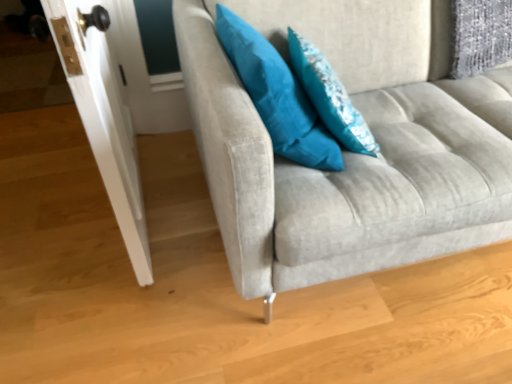
What is the approximate width of suede gray couch at center?

The width of suede gray couch at center is 35.99 inches.

Image resolution: width=512 pixels, height=384 pixels. I want to click on white glossy door at left, so click(x=103, y=120).

Based on the photo, considering the relative sizes of suede gray couch at center and white glossy door at left in the image provided, is suede gray couch at center bigger than white glossy door at left?

Yes.

Would you say suede gray couch at center is outside white glossy door at left?

suede gray couch at center lies outside white glossy door at left's area.

Which is behind, suede gray couch at center or white glossy door at left?

white glossy door at left is more distant.

From a real-world perspective, is suede gray couch at center over white glossy door at left?

No, from a real-world perspective, suede gray couch at center is not above white glossy door at left.

Is teal fabric pillow at upper center, the 2th pillow from the left, oriented towards white glossy door at left?

A: No, teal fabric pillow at upper center, the 2th pillow from the left, is not turned towards white glossy door at left.

Is teal fabric pillow at upper center, the 2th pillow from the left, smaller than white glossy door at left?

Indeed, teal fabric pillow at upper center, the 2th pillow from the left, has a smaller size compared to white glossy door at left.

From the picture: Can you tell me how much teal fabric pillow at upper center, the 2th pillow from the left, and white glossy door at left differ in facing direction?

teal fabric pillow at upper center, the 2th pillow from the left, and white glossy door at left are facing 171 degrees away from each other.

Are teal fabric pillow at upper center, positioned as the first pillow in right-to-left order, and white glossy door at left making contact?

No, teal fabric pillow at upper center, positioned as the first pillow in right-to-left order, is not with white glossy door at left.

Which object is closer to the camera taking this photo, teal fabric pillow at upper right, arranged as the second pillow when viewed from the right, or teal fabric pillow at upper center, the 2th pillow from the left?

teal fabric pillow at upper right, arranged as the second pillow when viewed from the right, is more forward.

Does teal fabric pillow at upper right, the 1th pillow positioned from the left, appear on the left side of teal fabric pillow at upper center, positioned as the first pillow in right-to-left order?

Yes, teal fabric pillow at upper right, the 1th pillow positioned from the left, is to the left of teal fabric pillow at upper center, positioned as the first pillow in right-to-left order.

Is teal fabric pillow at upper right, arranged as the second pillow when viewed from the right, not near teal fabric pillow at upper center, the 2th pillow from the left?

teal fabric pillow at upper right, arranged as the second pillow when viewed from the right, is actually quite close to teal fabric pillow at upper center, the 2th pillow from the left.

Does teal fabric pillow at upper right, arranged as the second pillow when viewed from the right, turn towards teal fabric pillow at upper center, the 2th pillow from the left?

Yes.

From the image's perspective, is suede gray couch at center located beneath teal fabric pillow at upper center, the 2th pillow from the left?

No.

In the scene shown: Considering the positions of objects suede gray couch at center and teal fabric pillow at upper center, the 2th pillow from the left, in the image provided, who is in front, suede gray couch at center or teal fabric pillow at upper center, the 2th pillow from the left,?

Positioned in front is suede gray couch at center.

Is suede gray couch at center wider or thinner than teal fabric pillow at upper center, the 2th pillow from the left?

suede gray couch at center is wider than teal fabric pillow at upper center, the 2th pillow from the left.

Who is taller, suede gray couch at center or teal fabric pillow at upper center, the 2th pillow from the left?

Standing taller between the two is suede gray couch at center.

Which of these two, white glossy door at left or teal fabric pillow at upper right, arranged as the second pillow when viewed from the right, stands taller?

white glossy door at left.

Considering the positions of objects white glossy door at left and teal fabric pillow at upper right, the 1th pillow positioned from the left, in the image provided, who is behind, white glossy door at left or teal fabric pillow at upper right, the 1th pillow positioned from the left,?

teal fabric pillow at upper right, the 1th pillow positioned from the left, is more distant.

Can you confirm if white glossy door at left is positioned to the right of teal fabric pillow at upper right, arranged as the second pillow when viewed from the right?

Incorrect, white glossy door at left is not on the right side of teal fabric pillow at upper right, arranged as the second pillow when viewed from the right.

From the image's perspective, is white glossy door at left below teal fabric pillow at upper right, the 1th pillow positioned from the left?

Yes.

How different are the orientations of teal fabric pillow at upper right, the 1th pillow positioned from the left, and white glossy door at left in degrees?

The facing directions of teal fabric pillow at upper right, the 1th pillow positioned from the left, and white glossy door at left are 171 degrees apart.

Between teal fabric pillow at upper right, arranged as the second pillow when viewed from the right, and white glossy door at left, which one appears on the left side from the viewer's perspective?

From the viewer's perspective, white glossy door at left appears more on the left side.

Is teal fabric pillow at upper right, the 1th pillow positioned from the left, oriented towards white glossy door at left?

No, teal fabric pillow at upper right, the 1th pillow positioned from the left, does not turn towards white glossy door at left.

From the image's perspective, is teal fabric pillow at upper right, the 1th pillow positioned from the left, below white glossy door at left?

No, from the image's perspective, teal fabric pillow at upper right, the 1th pillow positioned from the left, is not below white glossy door at left.

In the image, is white glossy door at left on the left side or the right side of suede gray couch at center?

In the image, white glossy door at left appears on the left side of suede gray couch at center.

Looking at this image, is white glossy door at left facing away from suede gray couch at center?

That's right, white glossy door at left is facing away from suede gray couch at center.

Who is bigger, white glossy door at left or suede gray couch at center?

Bigger between the two is suede gray couch at center.

How distant is white glossy door at left from suede gray couch at center?

A distance of 54.90 centimeters exists between white glossy door at left and suede gray couch at center.

Where is `studio couch located underneath the white glossy door at left (from a real-world perspective)`? studio couch located underneath the white glossy door at left (from a real-world perspective) is located at coordinates (349, 152).

At what (x,y) coordinates should I click in order to perform the action: click on pillow that is the 1st object above the white glossy door at left (from a real-world perspective). Please return your answer as a coordinate pair (x, y). Image resolution: width=512 pixels, height=384 pixels. Looking at the image, I should click on (330, 96).

Considering their positions, is teal fabric pillow at upper center, the 2th pillow from the left, positioned closer to white glossy door at left than suede gray couch at center?

suede gray couch at center.

Estimate the real-world distances between objects in this image. Which object is closer to teal fabric pillow at upper right, arranged as the second pillow when viewed from the right, white glossy door at left or teal fabric pillow at upper center, positioned as the first pillow in right-to-left order?

teal fabric pillow at upper center, positioned as the first pillow in right-to-left order, is positioned closer to the anchor teal fabric pillow at upper right, arranged as the second pillow when viewed from the right.

Based on their spatial positions, is white glossy door at left or suede gray couch at center closer to teal fabric pillow at upper right, the 1th pillow positioned from the left?

suede gray couch at center lies closer to teal fabric pillow at upper right, the 1th pillow positioned from the left, than the other object.

Estimate the real-world distances between objects in this image. Which object is closer to teal fabric pillow at upper center, the 2th pillow from the left, teal fabric pillow at upper right, the 1th pillow positioned from the left, or suede gray couch at center?

teal fabric pillow at upper right, the 1th pillow positioned from the left, is positioned closer to the anchor teal fabric pillow at upper center, the 2th pillow from the left.

Looking at the image, which one is located further to teal fabric pillow at upper right, arranged as the second pillow when viewed from the right, suede gray couch at center or white glossy door at left?

The object further to teal fabric pillow at upper right, arranged as the second pillow when viewed from the right, is white glossy door at left.

Looking at the image, which one is located closer to white glossy door at left, suede gray couch at center or teal fabric pillow at upper right, the 1th pillow positioned from the left?

Answer: teal fabric pillow at upper right, the 1th pillow positioned from the left, is positioned closer to the anchor white glossy door at left.

Considering their positions, is white glossy door at left positioned closer to suede gray couch at center than teal fabric pillow at upper right, arranged as the second pillow when viewed from the right?

teal fabric pillow at upper right, arranged as the second pillow when viewed from the right, is positioned closer to the anchor suede gray couch at center.

Looking at the image, which one is located further to teal fabric pillow at upper center, the 2th pillow from the left, suede gray couch at center or teal fabric pillow at upper right, arranged as the second pillow when viewed from the right?

Based on the image, suede gray couch at center appears to be further to teal fabric pillow at upper center, the 2th pillow from the left.

This screenshot has height=384, width=512. Identify the location of pillow between teal fabric pillow at upper right, the 1th pillow positioned from the left, and suede gray couch at center, in the horizontal direction. pyautogui.click(x=330, y=96).

In order to click on pillow between white glossy door at left and teal fabric pillow at upper center, positioned as the first pillow in right-to-left order, from left to right in this screenshot , I will do `click(277, 96)`.